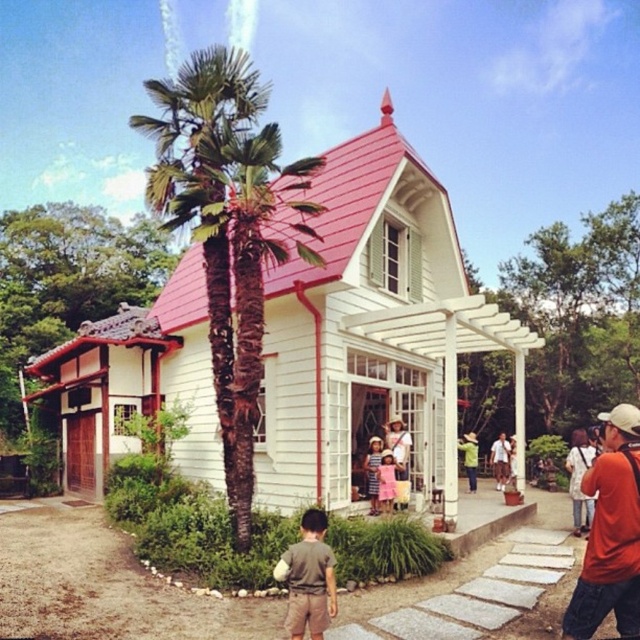
You are standing in front of the house and want to take a photo of the orange fabric camera at lower right without the green leafy palm tree at left blocking the view. Is it possible?

The green leafy palm tree at left is much taller than the orange fabric camera at lower right, so it may block the view. To take a photo of the orange fabric camera at lower right without obstruction, you would need to position yourself where the palm tree is not in front of the camera.

You are standing at point (225,228) in the image. What object is located at this point?

The green leafy palm tree at left is located at point (225,228).

You are a photographer standing in front of the house. You want to take a photo of the striped fabric dress at center without the orange fabric camera at lower right blocking it. Where should you move to achieve this?

Move to the left side of the orange fabric camera at lower right so it is no longer in front of the striped fabric dress at center.